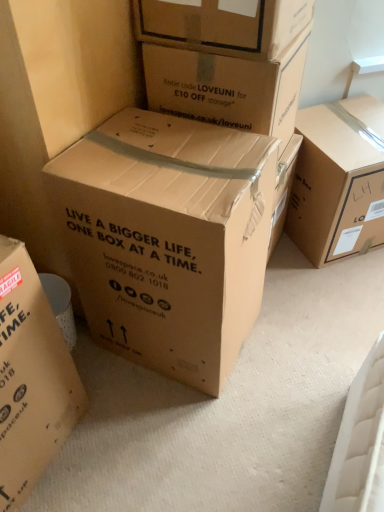
Question: Is brown cardboard box at upper right, which is the sixth box in left-to-right order, at the right side of brown cardboard box at center, the 3th box viewed from the left?

Choices:
 (A) yes
 (B) no

Answer: (A)

Question: Is brown cardboard box at upper right, which is the sixth box in left-to-right order, oriented away from brown cardboard box at center, the fourth box viewed from the right?

Choices:
 (A) no
 (B) yes

Answer: (A)

Question: Is brown cardboard box at upper right, which is the sixth box in left-to-right order, touching brown cardboard box at center, the 3th box viewed from the left?

Choices:
 (A) yes
 (B) no

Answer: (B)

Question: Does brown cardboard box at upper right, acting as the first box starting from the right, have a larger size compared to brown cardboard box at center, the 3th box viewed from the left?

Choices:
 (A) no
 (B) yes

Answer: (A)

Question: From a real-world perspective, is brown cardboard box at upper right, which is the sixth box in left-to-right order, positioned under brown cardboard box at center, the 3th box viewed from the left, based on gravity?

Choices:
 (A) no
 (B) yes

Answer: (B)

Question: Is point (336, 106) positioned closer to the camera than point (258, 108)?

Choices:
 (A) closer
 (B) farther

Answer: (B)

Question: Considering the positions of brown cardboard box at upper right, which is the sixth box in left-to-right order, and brown cardboard box at upper center, the 5th box from the left, in the image, is brown cardboard box at upper right, which is the sixth box in left-to-right order, bigger or smaller than brown cardboard box at upper center, the 5th box from the left,?

Choices:
 (A) small
 (B) big

Answer: (B)

Question: From the image's perspective, is brown cardboard box at upper right, which is the sixth box in left-to-right order, above or below brown cardboard box at upper center, the 5th box from the left?

Choices:
 (A) below
 (B) above

Answer: (A)

Question: Is brown cardboard box at upper right, which is the sixth box in left-to-right order, inside the boundaries of brown cardboard box at upper center, the second box in the right-to-left sequence, or outside?

Choices:
 (A) outside
 (B) inside

Answer: (A)

Question: From a real-world perspective, relative to brown cardboard box at center, which is the first box in left-to-right order, is brown cardboard box at upper center, the 5th box from the left, vertically above or below?

Choices:
 (A) below
 (B) above

Answer: (B)

Question: Considering the positions of brown cardboard box at upper center, the second box in the right-to-left sequence, and brown cardboard box at center, which is the first box in left-to-right order, in the image, is brown cardboard box at upper center, the second box in the right-to-left sequence, bigger or smaller than brown cardboard box at center, which is the first box in left-to-right order,?

Choices:
 (A) big
 (B) small

Answer: (B)

Question: Considering the positions of point (253, 98) and point (74, 373), is point (253, 98) closer or farther from the camera than point (74, 373)?

Choices:
 (A) farther
 (B) closer

Answer: (B)

Question: In the image, is brown cardboard box at upper center, the second box in the right-to-left sequence, positioned in front of or behind brown cardboard box at center, which appears as the 6th box when viewed from the right?

Choices:
 (A) front
 (B) behind

Answer: (B)

Question: Considering their positions, is brown cardboard box at center, which ranks as the second box in left-to-right order, located in front of or behind brown cardboard box at center, the 3th box viewed from the left?

Choices:
 (A) front
 (B) behind

Answer: (A)

Question: From the image's perspective, is brown cardboard box at center, placed as the fifth box when sorted from right to left, positioned above or below brown cardboard box at center, the fourth box viewed from the right?

Choices:
 (A) below
 (B) above

Answer: (B)